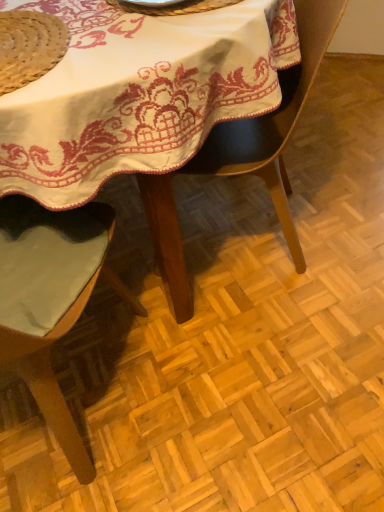
Where is `vacant space to the right of natural straw hat at upper left`? The image size is (384, 512). vacant space to the right of natural straw hat at upper left is located at coordinates (132, 50).